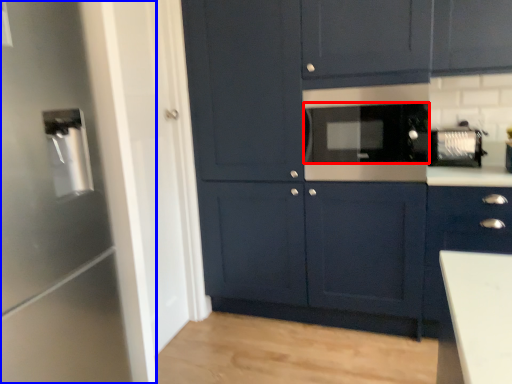
Question: Which object is closer to the camera taking this photo, appliance (highlighted by a red box) or appliance (highlighted by a blue box)?

Choices:
 (A) appliance
 (B) appliance

Answer: (B)